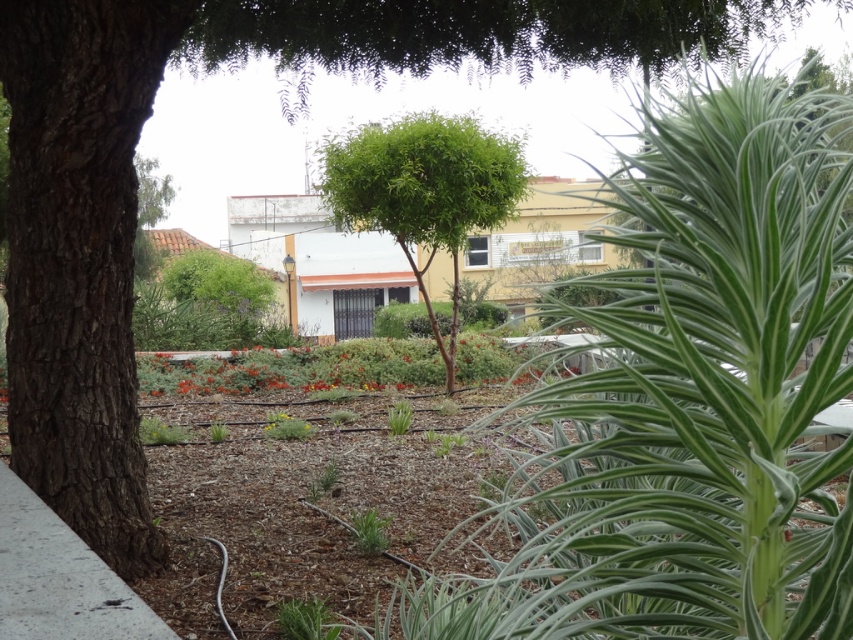
Is green leafy tree at center below gray concrete pavement at lower left?

Incorrect, green leafy tree at center is not positioned below gray concrete pavement at lower left.

Is point (486, 132) behind point (106, 637)?

Yes, point (486, 132) is farther from viewer.

Measure the distance between point (364,150) and camera.

A distance of 41.64 feet exists between point (364,150) and camera.

Where is `green leafy tree at center`? Image resolution: width=853 pixels, height=640 pixels. green leafy tree at center is located at coordinates (424, 193).